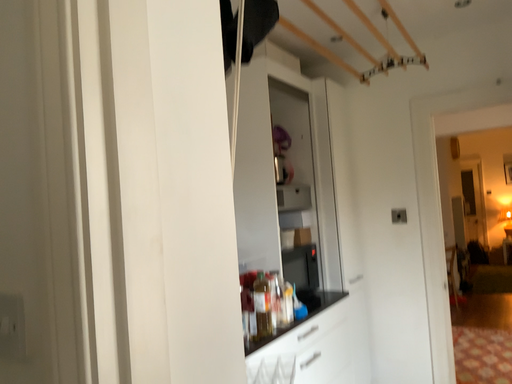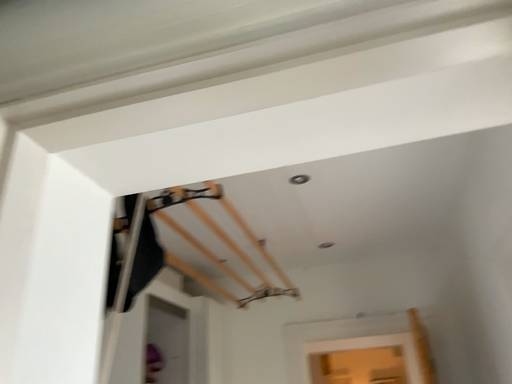
Question: Which way did the camera rotate in the video?

Choices:
 (A) rotated upward
 (B) rotated downward

Answer: (A)